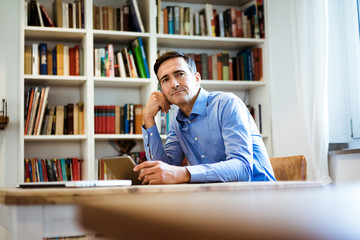
Locate an element on the screen. The width and height of the screenshot is (360, 240). books in the background is located at coordinates 125,69.